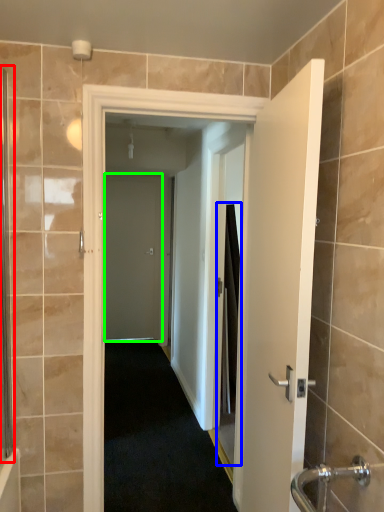
Question: Based on their relative distances, which object is nearer to screen door (highlighted by a red box)? Choose from screen door (highlighted by a blue box) and door (highlighted by a green box).

Choices:
 (A) screen door
 (B) door

Answer: (A)